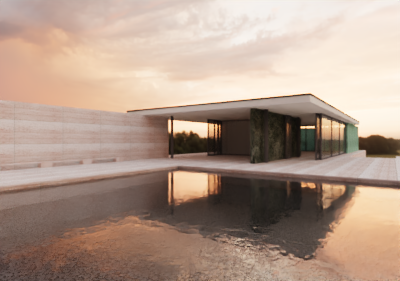
Find the location of a particular element. The height and width of the screenshot is (281, 400). pillar is located at coordinates (171, 146).